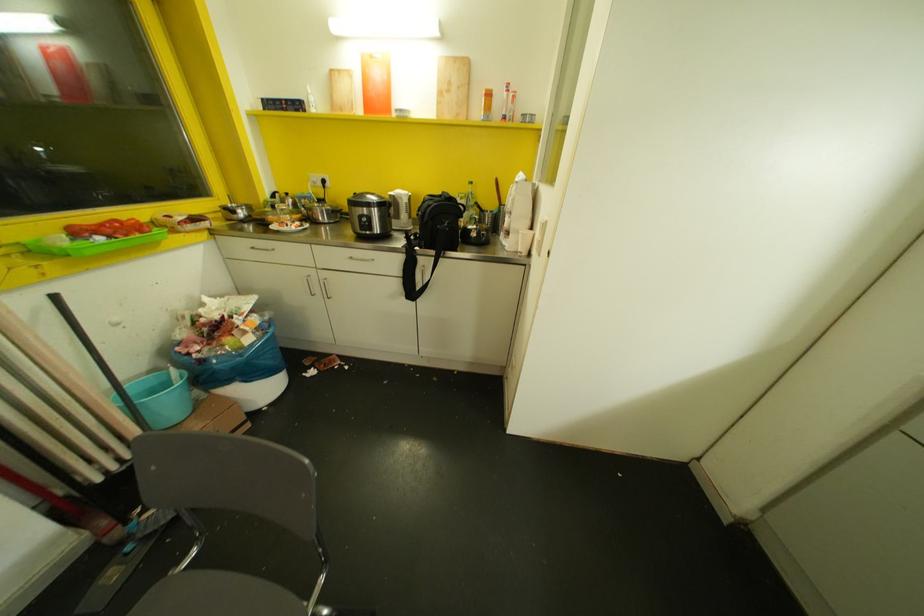
Describe the element at coordinates (98, 360) in the screenshot. Image resolution: width=924 pixels, height=616 pixels. I see `the long tool handle` at that location.